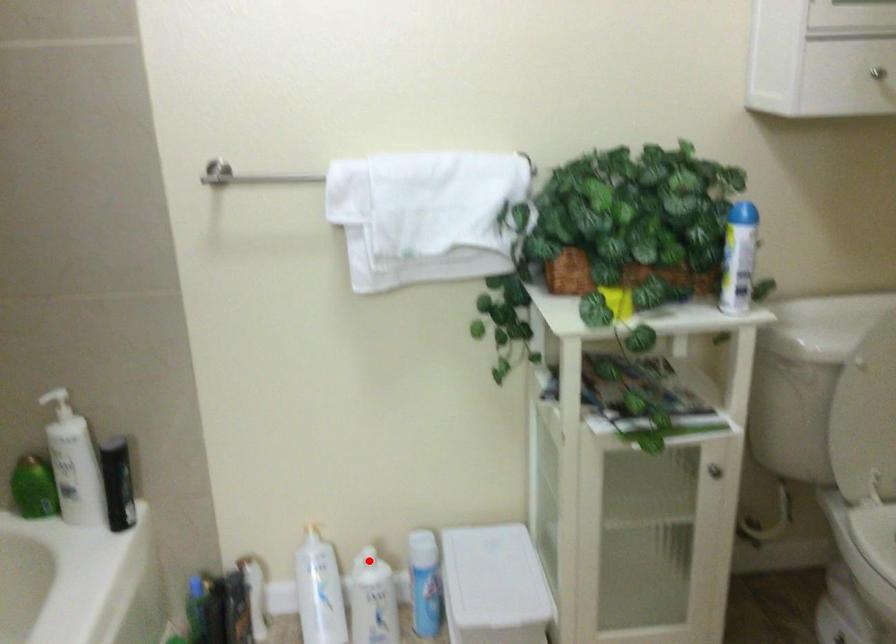
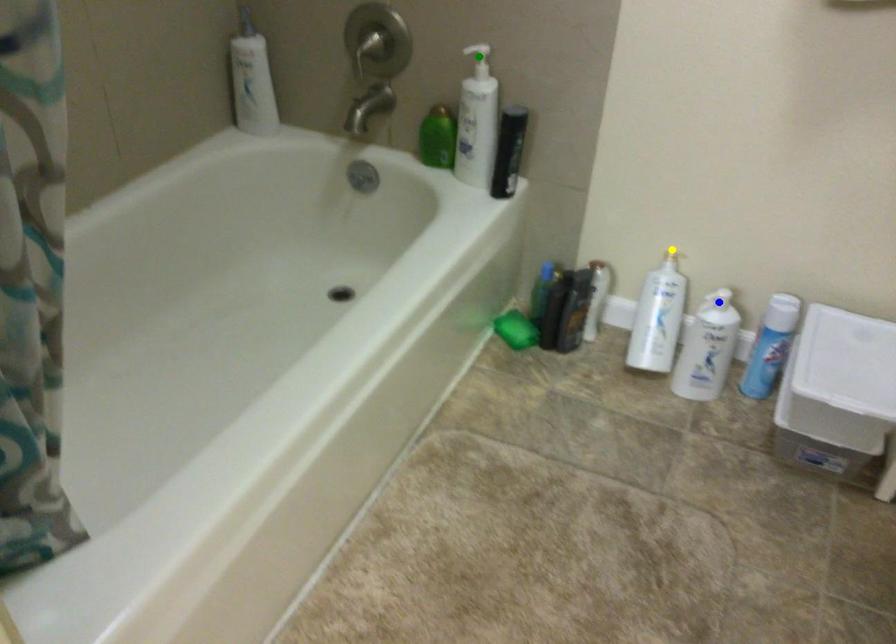
Question: I am providing you with two images of the same scene from different viewpoints. A red point is marked on the first image. You are given multiple points on the second image. In image 2, which mark is for the same physical point as the one in image 1?

Choices:
 (A) yellow point
 (B) green point
 (C) blue point

Answer: (C)